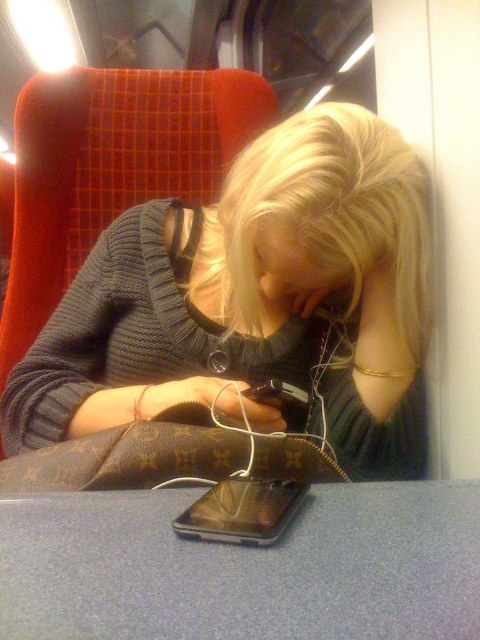
Question: Which of the following is the closest to the observer?

Choices:
 (A) (47, 440)
 (B) (218, 483)

Answer: (B)

Question: In this image, where is knitted sweater at center located relative to shiny metallic phone at center?

Choices:
 (A) right
 (B) left

Answer: (B)

Question: Which point appears farthest from the camera in this image?

Choices:
 (A) (197, 520)
 (B) (144, 262)

Answer: (B)

Question: Does knitted sweater at center have a lesser width compared to shiny metallic phone at center?

Choices:
 (A) no
 (B) yes

Answer: (A)

Question: Can you confirm if knitted sweater at center is smaller than shiny metallic phone at center?

Choices:
 (A) no
 (B) yes

Answer: (A)